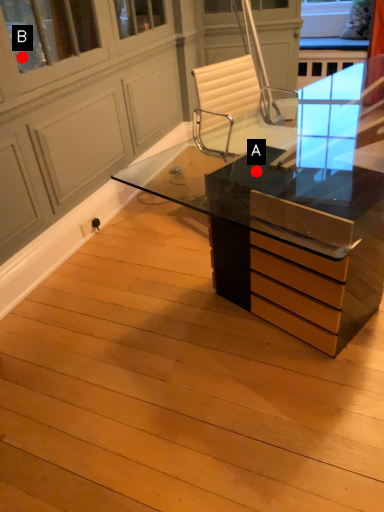
Question: Two points are circled on the image, labeled by A and B beside each circle. Which point appears closest to the camera in this image?

Choices:
 (A) A is closer
 (B) B is closer

Answer: (A)